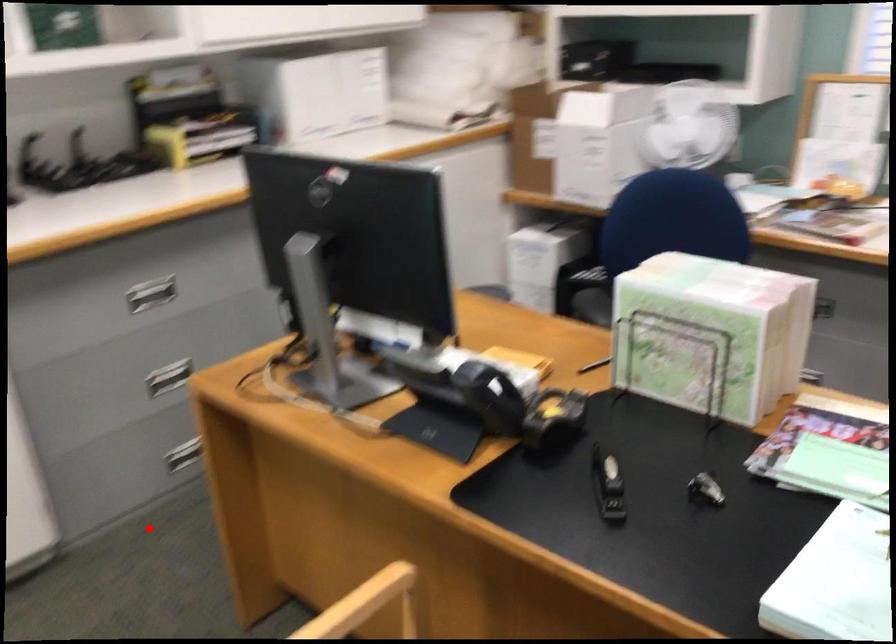
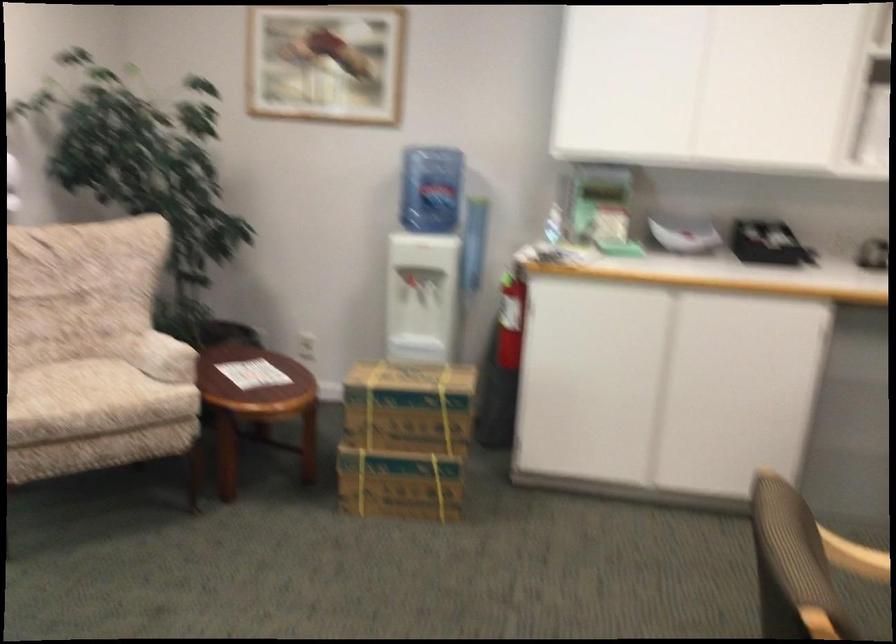
Locate, in the second image, the point that corresponds to the highlighted location in the first image.

(857, 529)